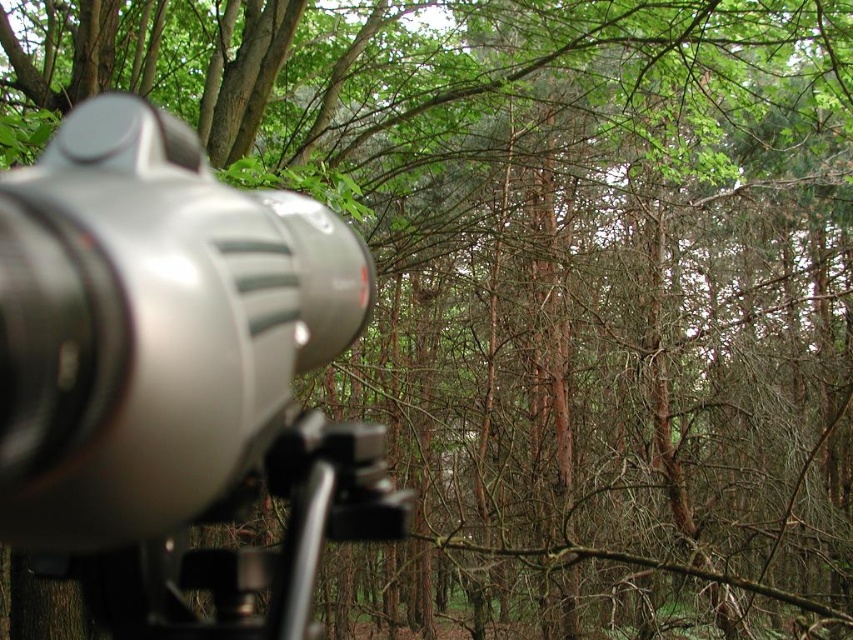
Question: Does satin silver camera at left appear under satin black tripod at lower left?

Choices:
 (A) no
 (B) yes

Answer: (A)

Question: Does satin silver camera at left appear on the left side of satin black tripod at lower left?

Choices:
 (A) yes
 (B) no

Answer: (A)

Question: Which of the following is the farthest from the observer?

Choices:
 (A) (369, 449)
 (B) (328, 241)

Answer: (B)

Question: Which of the following is the farthest from the observer?

Choices:
 (A) satin silver camera at left
 (B) satin black tripod at lower left

Answer: (B)

Question: Which point appears farthest from the camera in this image?

Choices:
 (A) (358, 445)
 (B) (128, 260)

Answer: (A)

Question: Is satin silver camera at left below satin black tripod at lower left?

Choices:
 (A) yes
 (B) no

Answer: (B)